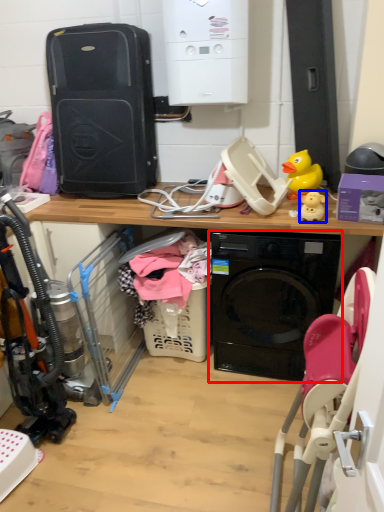
Question: Among these objects, which one is nearest to the camera, washing machine (highlighted by a red box) or toy (highlighted by a blue box)?

Choices:
 (A) washing machine
 (B) toy

Answer: (A)